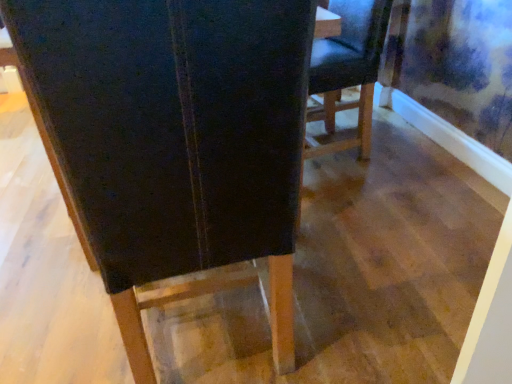
Question: Considering the positions of point (364, 31) and point (59, 71), is point (364, 31) closer or farther from the camera than point (59, 71)?

Choices:
 (A) closer
 (B) farther

Answer: (B)

Question: From a real-world perspective, is matte black chair at center, the first chair viewed from the right, physically located above or below black leather chair at center, which ranks as the 1th chair in front-to-back order?

Choices:
 (A) below
 (B) above

Answer: (A)

Question: Considering the relative positions of matte black chair at center, the first chair viewed from the right, and black leather chair at center, which appears as the first chair when viewed from the left, in the image provided, is matte black chair at center, the first chair viewed from the right, to the left or to the right of black leather chair at center, which appears as the first chair when viewed from the left,?

Choices:
 (A) right
 (B) left

Answer: (A)

Question: Considering the relative positions of black leather chair at center, which ranks as the 1th chair in front-to-back order, and matte black chair at center, the first chair viewed from the right, in the image provided, is black leather chair at center, which ranks as the 1th chair in front-to-back order, to the left or to the right of matte black chair at center, the first chair viewed from the right,?

Choices:
 (A) right
 (B) left

Answer: (B)

Question: Is point (222, 84) closer or farther from the camera than point (369, 144)?

Choices:
 (A) closer
 (B) farther

Answer: (A)

Question: In terms of height, does black leather chair at center, arranged as the second chair when viewed from the back, look taller or shorter compared to matte black chair at center, the first chair viewed from the right?

Choices:
 (A) short
 (B) tall

Answer: (B)

Question: Do you think black leather chair at center, which appears as the first chair when viewed from the left, is within matte black chair at center, arranged as the first chair when viewed from the back, or outside of it?

Choices:
 (A) outside
 (B) inside

Answer: (A)